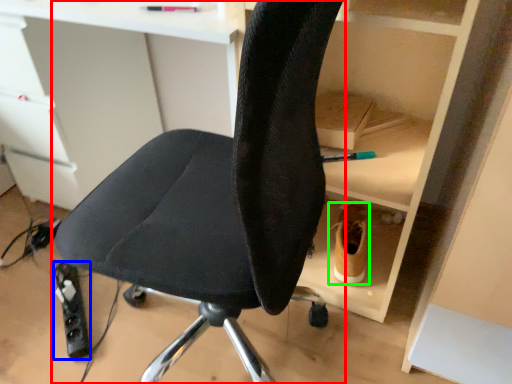
Question: Considering the real-world distances, which object is closest to chair (highlighted by a red box)? equipment (highlighted by a blue box) or footwear (highlighted by a green box).

Choices:
 (A) equipment
 (B) footwear

Answer: (B)